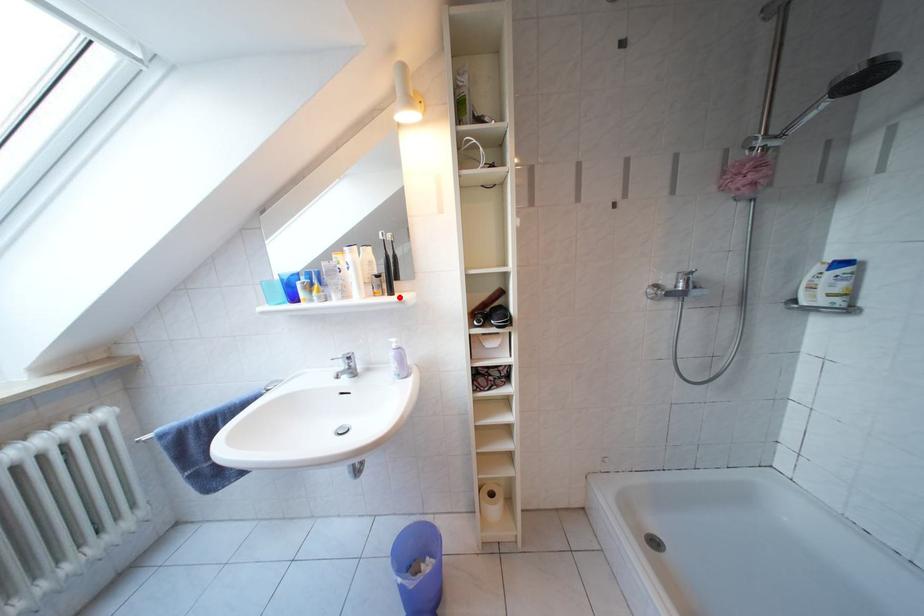
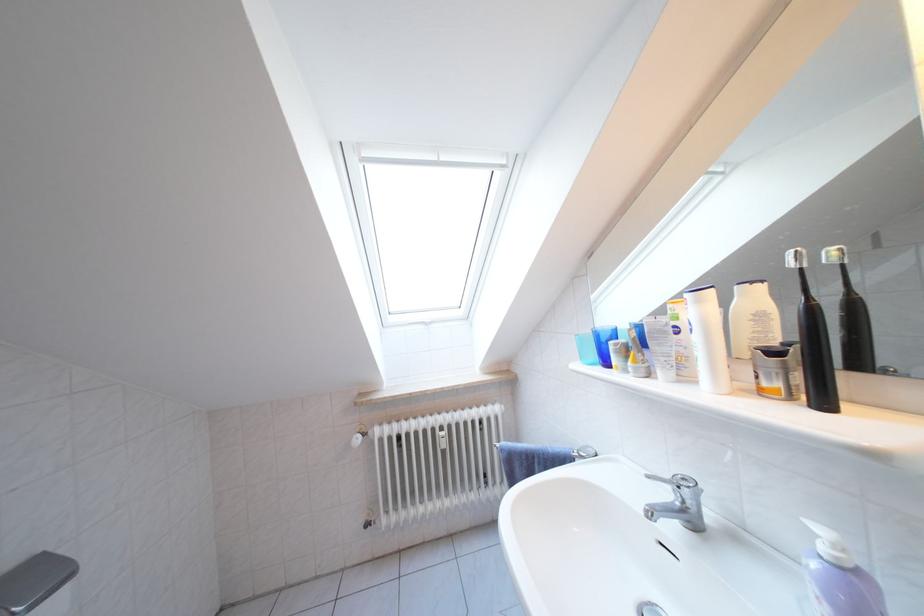
Find the pixel in the second image that matches the highlighted location in the first image.

(833, 407)